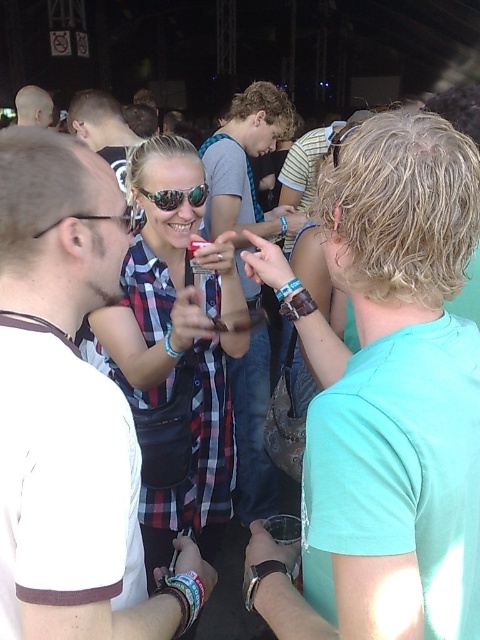
You are standing in the center of the tent and see the point marked at coordinates (385, 397). Which object is this point located on?

The point marked at coordinates (385, 397) is located on the teal fabric shirt at center.

You are at a festival and see the plaid shirt at center and the matte black hair at upper left. Which person is closer to you?

The plaid shirt at center is closer to you because it is in front of the matte black hair at upper left.